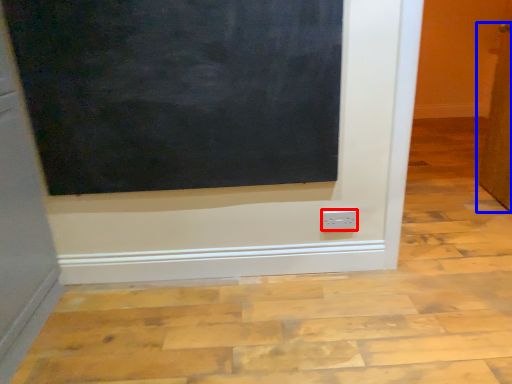
Question: Among these objects, which one is farthest to the camera, power plugs and sockets (highlighted by a red box) or door (highlighted by a blue box)?

Choices:
 (A) power plugs and sockets
 (B) door

Answer: (B)